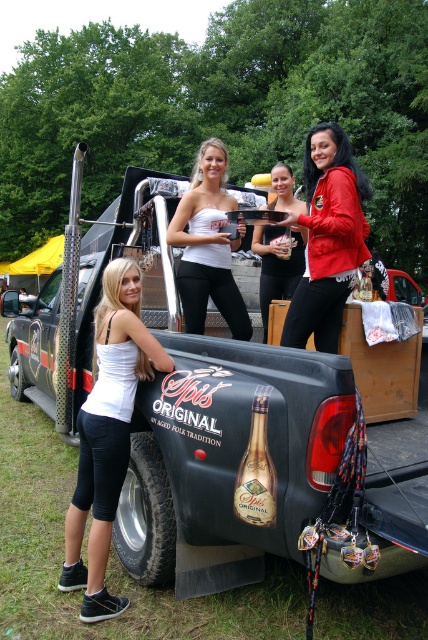
Based on the photo, you are a photographer trying to capture the black matte truck at center and the white fabric tank top at lower left in the same frame. Which object should you focus on first to ensure both are in the frame?

The black matte truck at center is smaller than the white fabric tank top at lower left, so you should focus on the white fabric tank top at lower left first to ensure both fit in the frame.

You are standing at the point with coordinates point (327, 237). What object is located at that point?

The point (327, 237) corresponds to the red leather jacket at center.